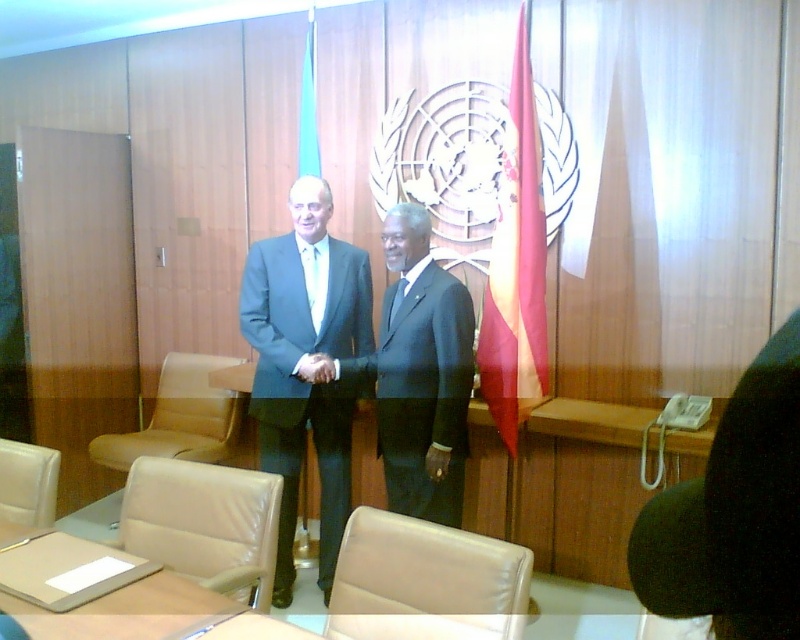
Question: Does red fabric flag at right appear on the left side of beige leather chair at lower left?

Choices:
 (A) yes
 (B) no

Answer: (B)

Question: Which point appears closest to the camera in this image?

Choices:
 (A) (250, 595)
 (B) (276, 467)
 (C) (505, 264)

Answer: (A)

Question: Where is beige leather chair at lower left located in relation to blue fabric flag at center in the image?

Choices:
 (A) below
 (B) above

Answer: (A)

Question: Which point appears closest to the camera in this image?

Choices:
 (A) (202, 460)
 (B) (402, 284)
 (C) (413, 540)
 (D) (336, 369)

Answer: (C)

Question: Among these objects, which one is nearest to the camera?

Choices:
 (A) beige leather chair at lower left
 (B) leather chair at lower left

Answer: (A)

Question: Does matte blue suit at center appear over matte black suit at center?

Choices:
 (A) yes
 (B) no

Answer: (B)